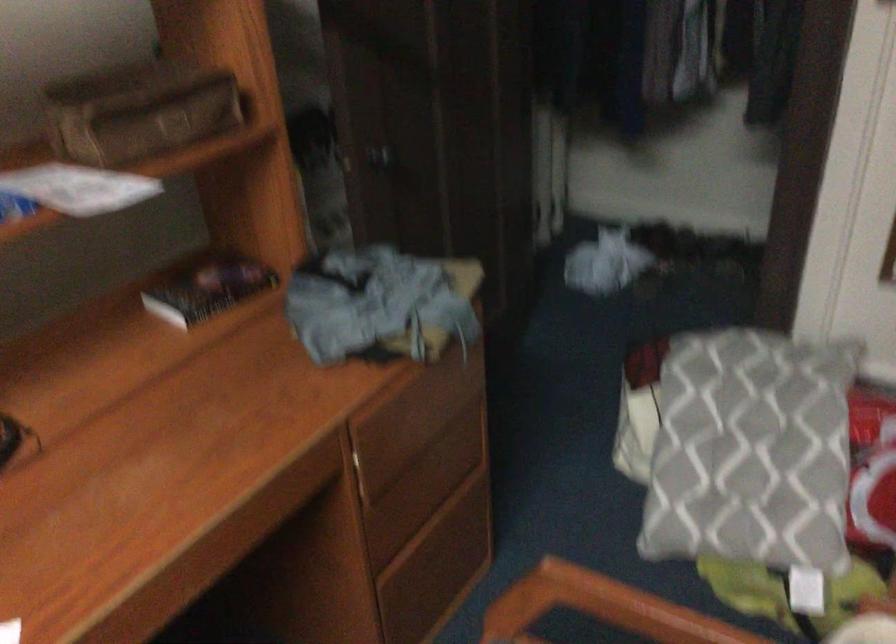
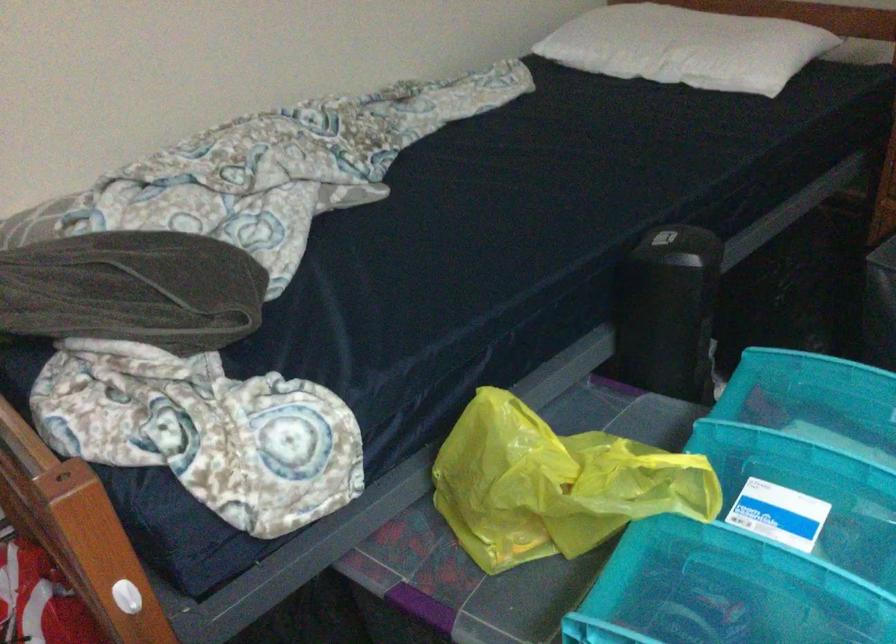
First-person continuous shooting, in which direction is the camera rotating?

The camera's rotation is toward right-down.